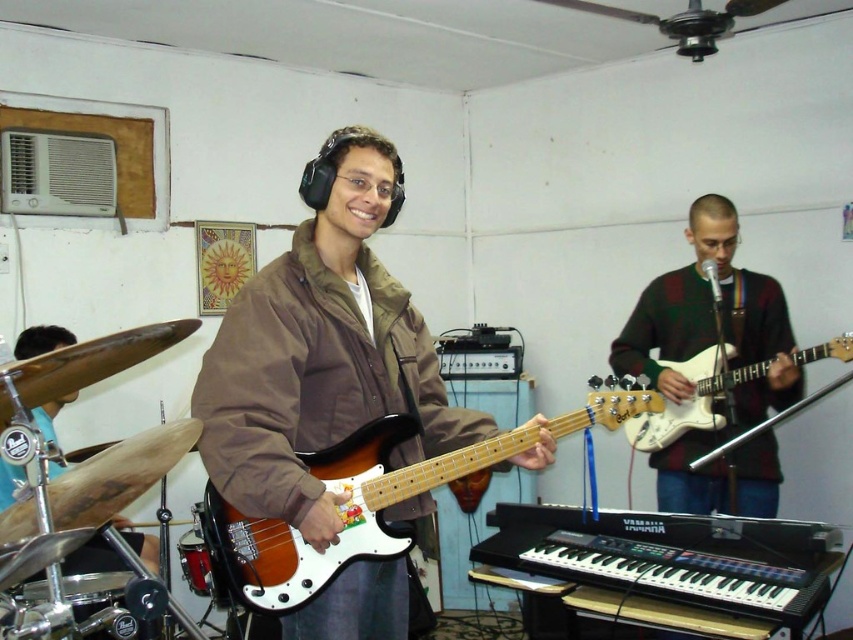
Question: Which object appears farthest from the camera in this image?

Choices:
 (A) green sweater at center
 (B) brushed metal drum at lower left
 (C) satin wood bass guitar at center

Answer: (A)

Question: Considering the relative positions of green sweater at center and satin wood bass guitar at center in the image provided, where is green sweater at center located with respect to satin wood bass guitar at center?

Choices:
 (A) right
 (B) left

Answer: (A)

Question: Is green sweater at center above satin wood bass guitar at center?

Choices:
 (A) no
 (B) yes

Answer: (B)

Question: Based on their relative distances, which object is nearer to the brown fabric jacket at center?

Choices:
 (A) white glossy electric guitar at right
 (B) satin wood bass guitar at center
 (C) red drum at lower left
 (D) brushed metal drum at lower left

Answer: (B)

Question: Which of the following is the farthest from the observer?

Choices:
 (A) brown fabric jacket at center
 (B) satin wood bass guitar at center
 (C) red drum at lower left

Answer: (C)

Question: In this image, where is green sweater at center located relative to red drum at lower left?

Choices:
 (A) left
 (B) right

Answer: (B)